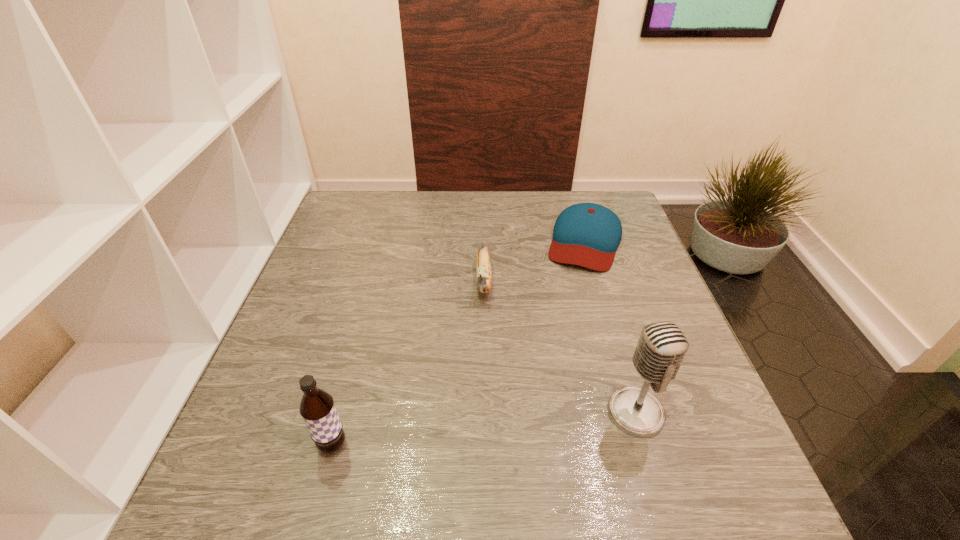
At what (x,y) coordinates should I click in order to perform the action: click on blank space located with the bill of the baseball cap facing forward. Please return your answer as a coordinate pair (x, y). Looking at the image, I should click on (564, 328).

This screenshot has height=540, width=960. In order to click on vacant space located at the stem of the banana in this screenshot , I will do `click(480, 424)`.

At what (x,y) coordinates should I click in order to perform the action: click on vacant space located 0.310m at the stem of the banana. Please return your answer as a coordinate pair (x, y). The height and width of the screenshot is (540, 960). Looking at the image, I should click on (480, 424).

Find the location of a particular element. Image resolution: width=960 pixels, height=540 pixels. vacant area situated 0.270m at the stem of the banana is located at coordinates (481, 406).

Image resolution: width=960 pixels, height=540 pixels. What are the coordinates of `object that is at the far edge` in the screenshot? It's located at (585, 234).

Identify the location of root beer positioned at the near edge. (317, 408).

At what (x,y) coordinates should I click in order to perform the action: click on microphone positioned at the near edge. Please return your answer as a coordinate pair (x, y). The image size is (960, 540). Looking at the image, I should click on (662, 346).

In order to click on object located at the left edge in this screenshot , I will do `click(317, 408)`.

You are a GUI agent. You are given a task and a screenshot of the screen. Output one action in this format:
    pyautogui.click(x=<x>, y=<y>)
    Task: Click on the microphone present at the right edge
    
    Given the screenshot: What is the action you would take?
    pyautogui.click(x=662, y=346)

Identify the location of baseball cap that is at the right edge. The image size is (960, 540). (585, 234).